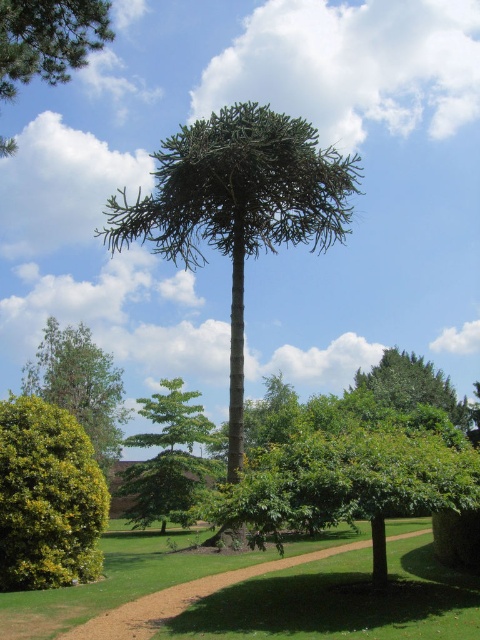
You are a landscape architect designing a garden layout. You have two trees to place in the garden. The green leafy tree at upper left and the green textured tree at upper center. Which tree should you choose if you want to fill a larger area in the garden?

The green textured tree at upper center should be chosen because it occupies more space than the green leafy tree at upper left.

You are standing in the outdoor scene and want to walk from the green leafy bush at lower left to the green textured tree at center. Which direction should you move?

You should move to the right to reach the green textured tree at center from the green leafy bush at lower left, as the tree is positioned to the right of the bush according to the scene description.